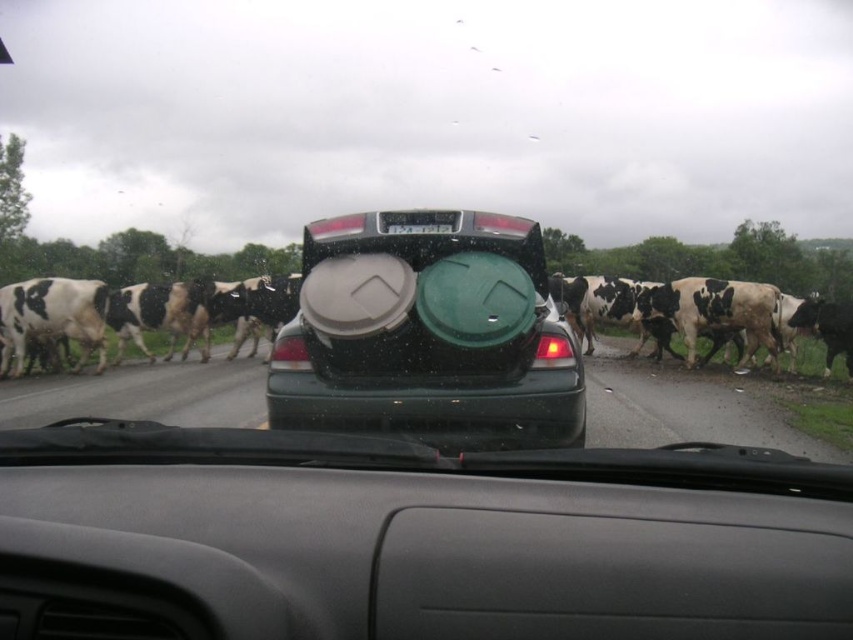
You are a passenger in a car observing the scene. You notice the matte plastic trash can at center and the black plastic license plate at center on the sedan ahead. Which object is positioned lower relative to the other?

The matte plastic trash can at center is located below the black plastic license plate at center, so it is positioned lower.

From the picture: You are driving a car and see a point at coordinates point (x=347, y=248) in the scene. If your car has a laser sensor with a maximum range of 5 meters, will it be able to detect that point?

The point (x=347, y=248) is 4.80 meters away from the viewer, so yes, the laser sensor can detect it since it is within the 5 meter range.

Looking at this image, you are sitting in a car and looking out the windshield at a scene where a herd of cows is crossing the road. There are two points marked on the trunk of a dark sedan in front of you. The first point is at coordinates point (360, 252) and the second point is at point (407, 225). Which of these two points is closer to you?

Point (360, 252) is closer to the viewer than point (407, 225).